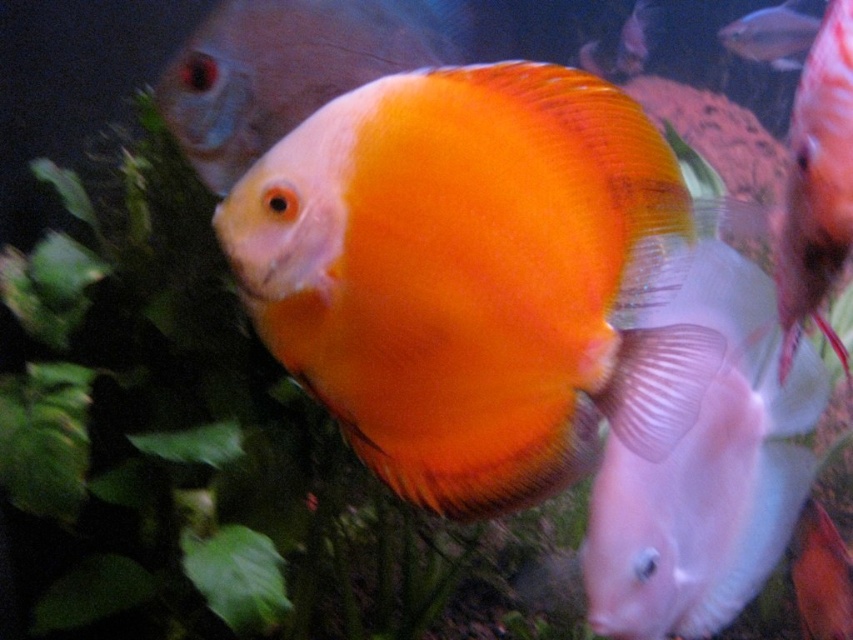
Who is more forward, (718, 257) or (276, 109)?

Point (718, 257) is in front.

Which is behind, point (747, 385) or point (265, 54)?

Positioned behind is point (265, 54).

Locate an element on the screen. matte white fish at lower right is located at coordinates (705, 467).

Is orange matte discus at center wider than orange matte goldfish at center?

Correct, the width of orange matte discus at center exceeds that of orange matte goldfish at center.

You are a GUI agent. You are given a task and a screenshot of the screen. Output one action in this format:
    pyautogui.click(x=<x>, y=<y>)
    Task: Click on the orange matte discus at center
    This screenshot has width=853, height=640.
    Given the screenshot: What is the action you would take?
    coord(473,276)

In the scene shown: Who is more forward, (x=514, y=196) or (x=810, y=307)?

Point (x=514, y=196) is in front.

At what (x,y) coordinates should I click in order to perform the action: click on orange matte discus at center. Please return your answer as a coordinate pair (x, y). Image resolution: width=853 pixels, height=640 pixels. Looking at the image, I should click on (473, 276).

Does matte white fish at lower right have a greater height compared to orange matte goldfish at center?

Correct, matte white fish at lower right is much taller as orange matte goldfish at center.

Between matte white fish at lower right and orange matte goldfish at center, which one is positioned higher?

orange matte goldfish at center

Identify the location of matte white fish at lower right. (705, 467).

At what (x,y) coordinates should I click in order to perform the action: click on matte white fish at lower right. Please return your answer as a coordinate pair (x, y). Looking at the image, I should click on (705, 467).